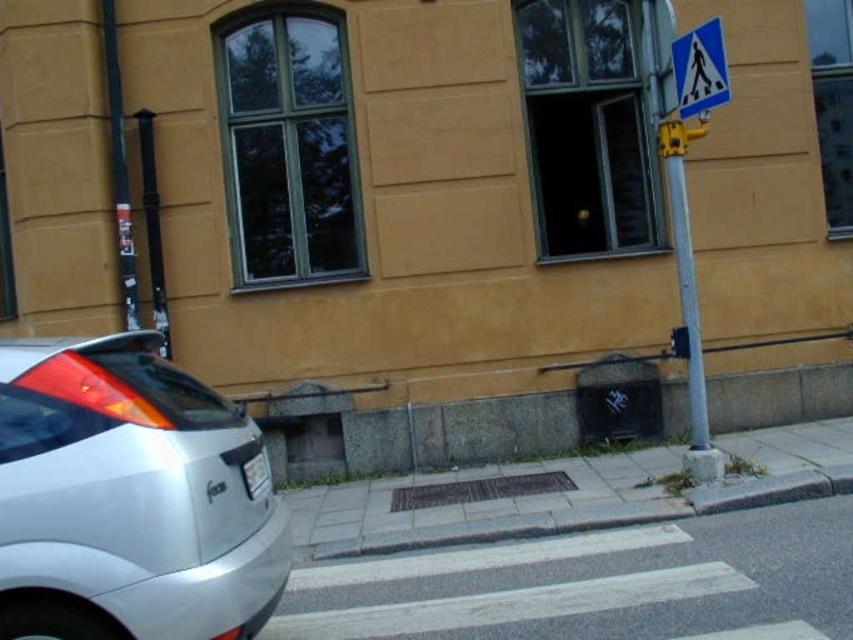
Question: Which point is farther to the camera?

Choices:
 (A) yellow plastic traffic light at upper right
 (B) yellow metallic pole at right
 (C) blue plastic pedestrian crossing sign at upper right
 (D) gray concrete curb at lower center

Answer: (B)

Question: Does yellow metallic pole at right have a lesser width compared to blue plastic pedestrian crossing sign at upper right?

Choices:
 (A) yes
 (B) no

Answer: (B)

Question: Does silver metallic hatchback at lower left have a lesser width compared to yellow metallic pole at right?

Choices:
 (A) yes
 (B) no

Answer: (B)

Question: Which of the following is the closest to the observer?

Choices:
 (A) yellow plastic traffic light at upper right
 (B) silver metallic hatchback at lower left
 (C) yellow metallic pole at right

Answer: (B)

Question: Estimate the real-world distances between objects in this image. Which object is farther from the brass textured grate at center?

Choices:
 (A) white plastic license plate at lower left
 (B) blue plastic pedestrian crossing sign at upper right
 (C) gray concrete curb at lower center

Answer: (A)

Question: Is silver metallic hatchback at lower left below gray concrete curb at lower center?

Choices:
 (A) yes
 (B) no

Answer: (B)